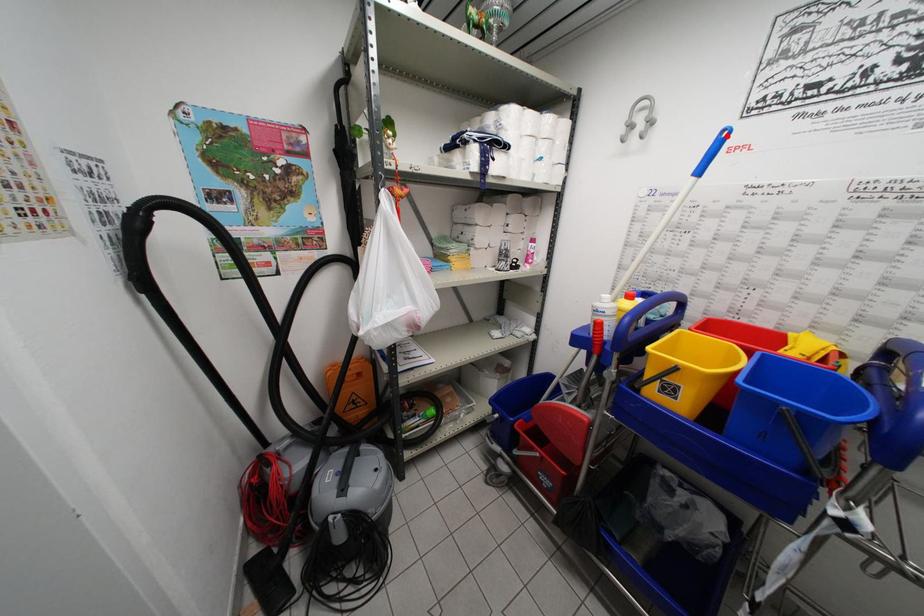
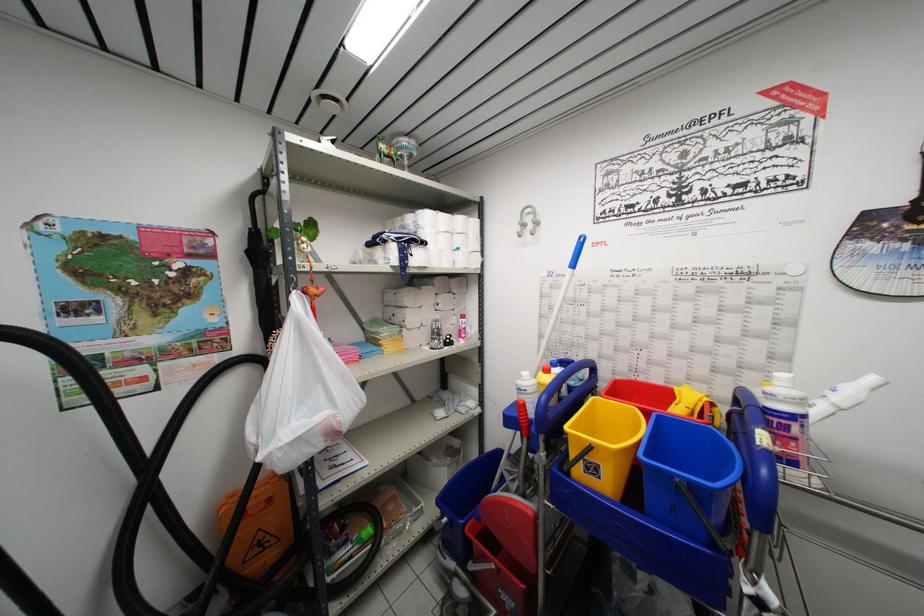
Question: I am providing you with two images of the same scene from different viewpoints. A red point is marked on the first image. Is the red point's position out of view in image 2?

Choices:
 (A) Yes
 (B) No

Answer: (B)